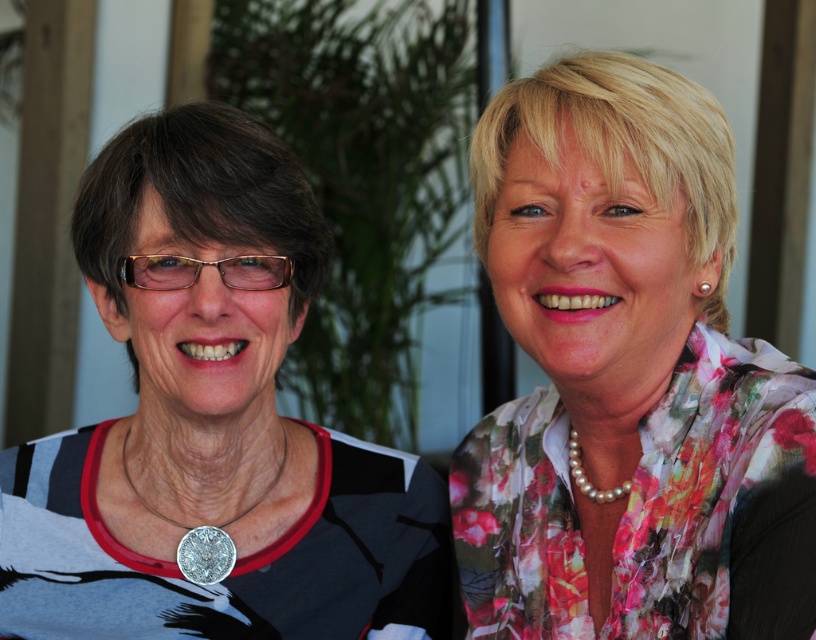
Does point (565, 292) come behind point (3, 540)?

No, it is not.

Image resolution: width=816 pixels, height=640 pixels. What do you see at coordinates (628, 378) in the screenshot? I see `floral fabric blouse at right` at bounding box center [628, 378].

Locate an element on the screen. The height and width of the screenshot is (640, 816). floral fabric blouse at right is located at coordinates (628, 378).

At what (x,y) coordinates should I click in order to perform the action: click on floral fabric blouse at right. Please return your answer as a coordinate pair (x, y). The image size is (816, 640). Looking at the image, I should click on (628, 378).

Is matte black shirt at left above silver metallic medal at lower left?

Yes.

Which of these two, matte black shirt at left or silver metallic medal at lower left, stands taller?

matte black shirt at left

Between point (220, 252) and point (234, 548), which one is positioned in front?

Positioned in front is point (220, 252).

Where is `matte black shirt at left`? matte black shirt at left is located at coordinates (213, 422).

Does floral fabric blouse at right lie in front of silver metallic medal at lower left?

Yes.

Which is more to the right, floral fabric blouse at right or silver metallic medal at lower left?

From the viewer's perspective, floral fabric blouse at right appears more on the right side.

Is point (723, 548) farther from camera compared to point (206, 566)?

No.

Where is `floral fabric blouse at right`? The height and width of the screenshot is (640, 816). floral fabric blouse at right is located at coordinates (628, 378).